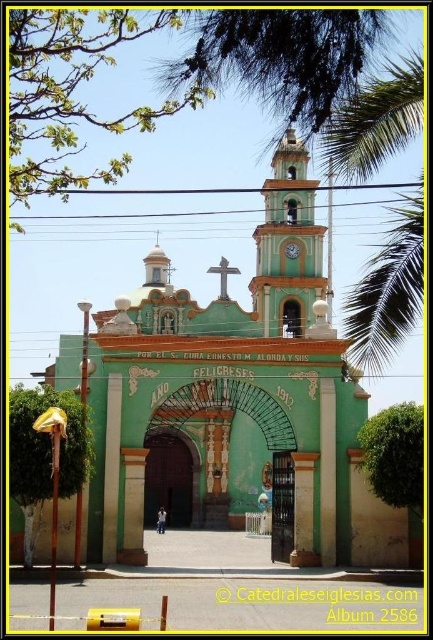
How much distance is there between green painted stone church at center and green leafy palm tree at upper right?

The distance of green painted stone church at center from green leafy palm tree at upper right is 66.43 feet.

Consider the image. Is the position of green painted stone church at center less distant than that of green leafy palm tree at upper right?

No, it is behind green leafy palm tree at upper right.

Does point (397, 522) come in front of point (390, 333)?

No, (397, 522) is behind (390, 333).

Where is `green painted stone church at center`? green painted stone church at center is located at coordinates (235, 403).

Is green leafy palm tree at upper right closer to the viewer compared to green painted wood clock at center?

That is True.

Consider the image. Does green leafy palm tree at upper right appear on the right side of green painted wood clock at center?

Yes, green leafy palm tree at upper right is to the right of green painted wood clock at center.

Is point (328, 141) farther from camera compared to point (287, 253)?

No.

Locate an element on the screen. The image size is (433, 640). green leafy palm tree at upper right is located at coordinates (388, 291).

Who is shorter, green painted stone church at center or green painted wood clock at center?

green painted wood clock at center

Does green painted stone church at center appear under green painted wood clock at center?

Yes, green painted stone church at center is below green painted wood clock at center.

Which is behind, point (384, 506) or point (294, 259)?

Positioned behind is point (294, 259).

I want to click on green painted stone church at center, so click(235, 403).